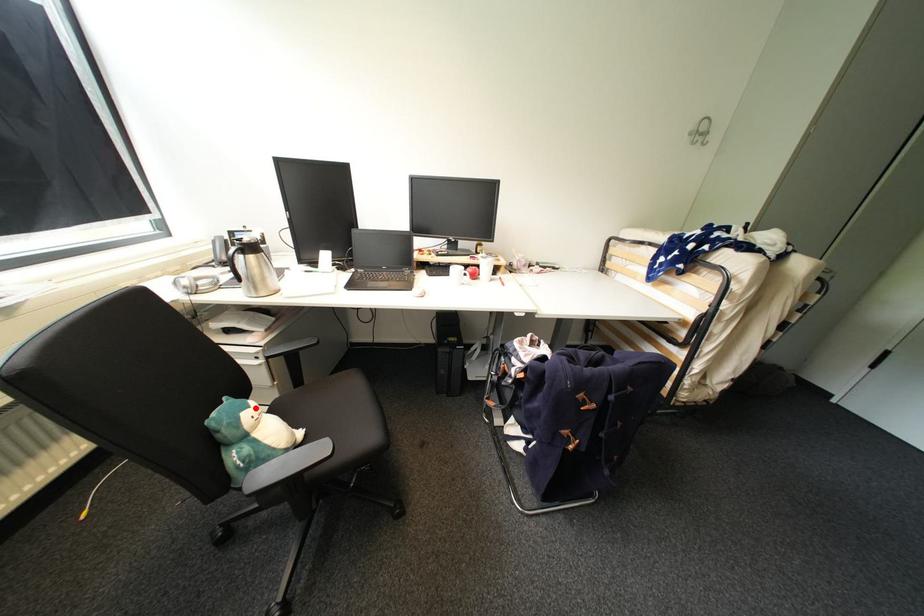
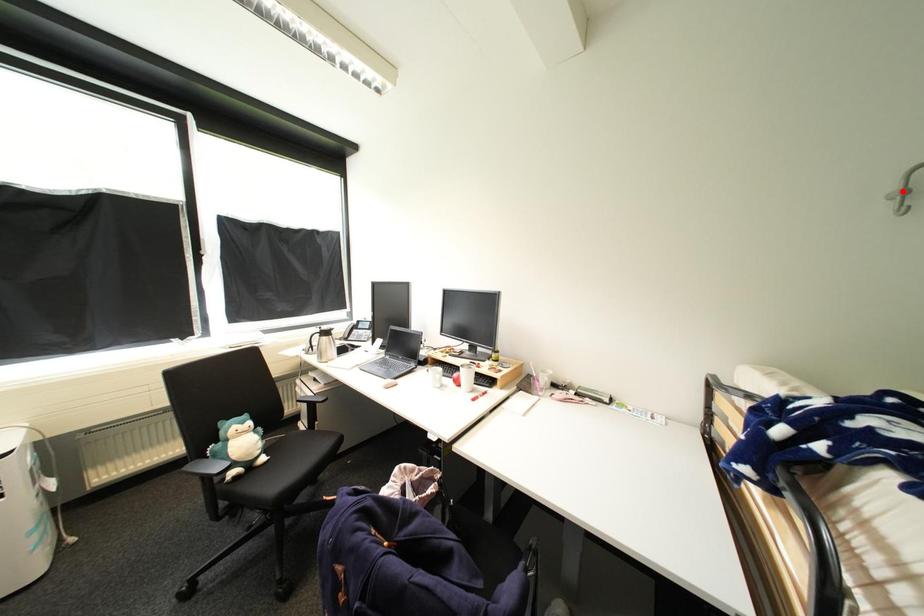
I am providing you with two images of the same scene from different viewpoints. A red point is marked on the first image and another point is marked on the second image. Are the points marked in image1 and image2 representing the same 3D position?

No